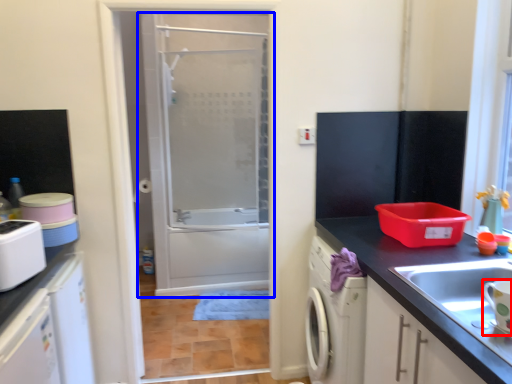
Question: Among these objects, which one is nearest to the camera, appliance (highlighted by a red box) or door (highlighted by a blue box)?

Choices:
 (A) appliance
 (B) door

Answer: (A)